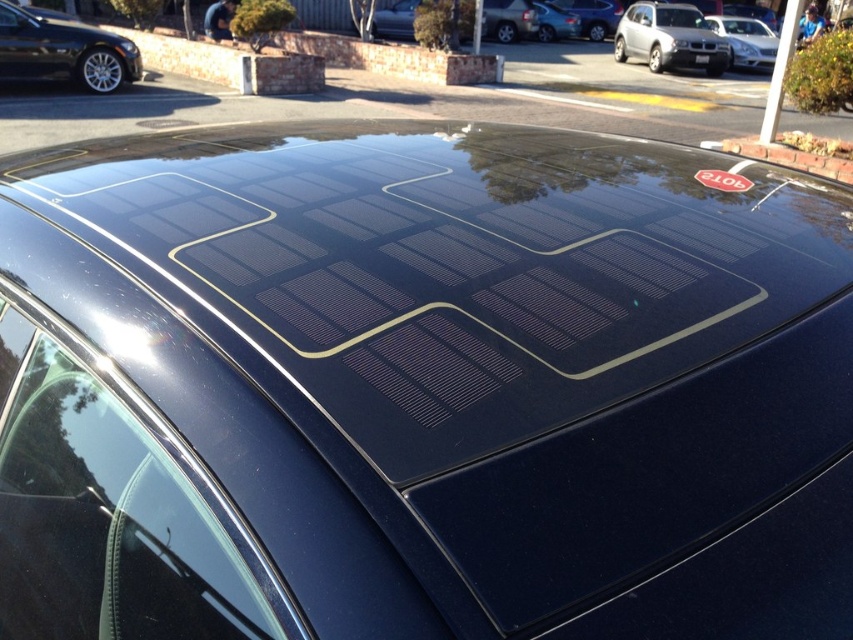
You are a parking attendant who needs to fit both the glossy black car at upper left and the satin silver sedan at upper right into a single parking spot that is 1.5 meters tall. Which car will require more vertical space and why?

The satin silver sedan at upper right requires more vertical space because it is taller than the glossy black car at upper left.

You are standing in a parking lot and see two vehicles, the satin silver suv at upper right and the satin silver sedan at upper right. Which one is nearer to you?

The satin silver suv at upper right is closer to the viewer than the satin silver sedan at upper right.